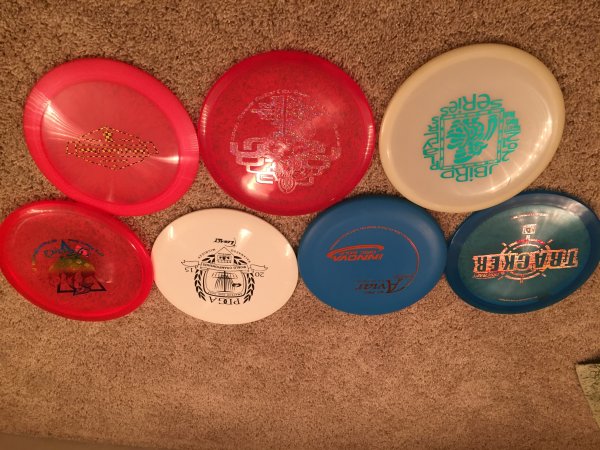
Image resolution: width=600 pixels, height=450 pixels. I want to click on carpet, so click(x=271, y=386).